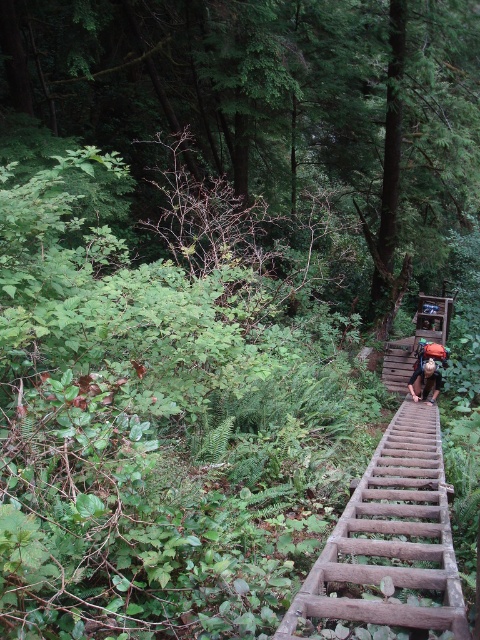
You are a hiker carrying a camouflage fabric backpack at center. You notice a green leafy tree at upper center above you. Which object is higher in elevation?

The green leafy tree at upper center is positioned over the camouflage fabric backpack at center, so it is higher in elevation.

You are a hiker carrying a camouflage fabric backpack at center and looking up at a green leafy tree at upper center. Which object is wider?

The green leafy tree at upper center is wider than the camouflage fabric backpack at center.